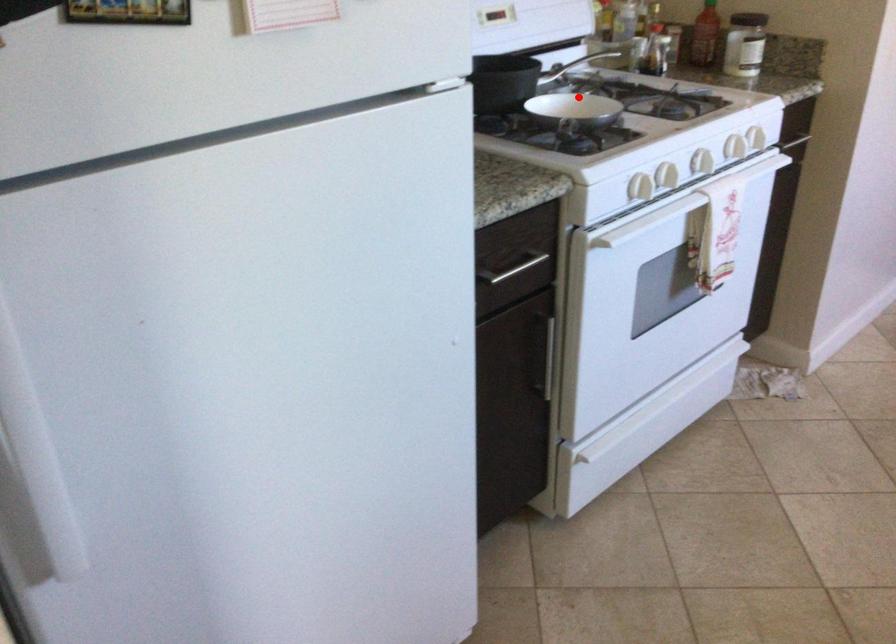
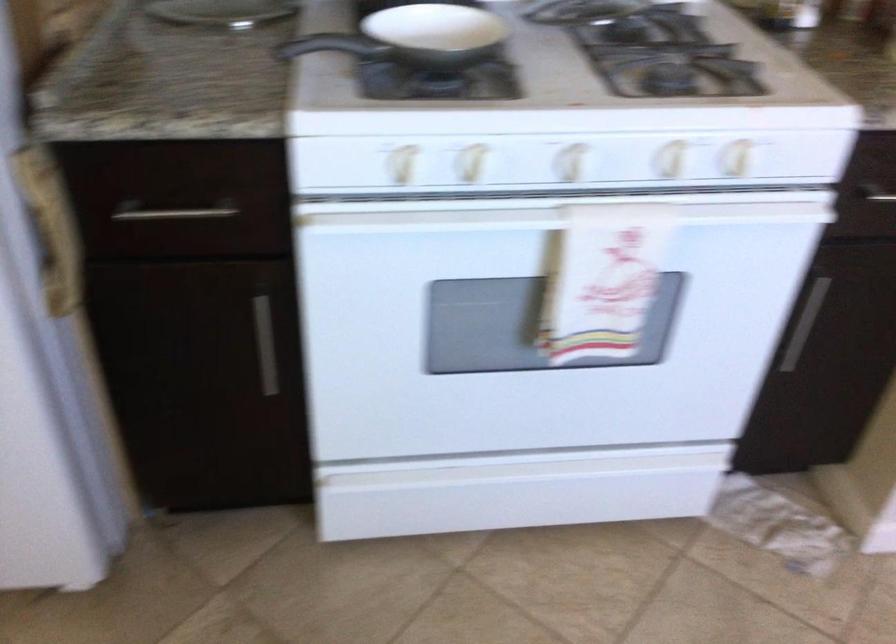
Question: I am providing you with two images of the same scene from different viewpoints. Given a red point in image1, look at the same physical point in image2. Is it:

Choices:
 (A) Closer to the viewpoint
 (B) Farther from the viewpoint

Answer: (A)